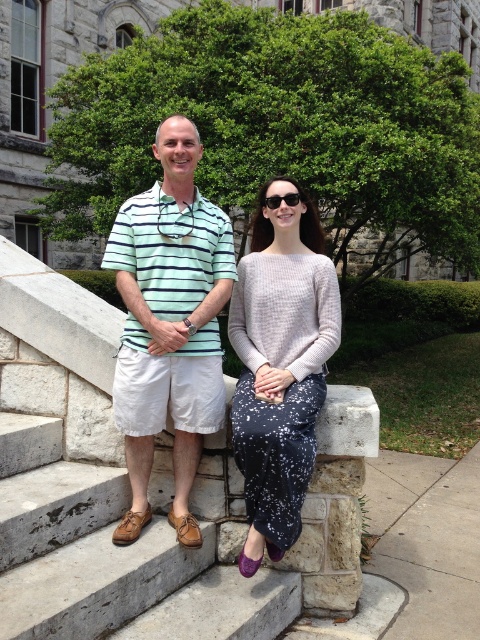
Question: Does brown leather shoe at lower left come in front of black plastic goggles at center?

Choices:
 (A) yes
 (B) no

Answer: (A)

Question: Can you confirm if striped cotton shirt at center is smaller than speckled fabric skirt at center?

Choices:
 (A) no
 (B) yes

Answer: (B)

Question: Considering the real-world distances, which object is closest to the striped cotton shirt at center?

Choices:
 (A) black plastic goggles at center
 (B) brown leather shoe at lower left
 (C) speckled fabric skirt at center

Answer: (C)

Question: Which point appears closest to the camera in this image?

Choices:
 (A) (92, 627)
 (B) (291, 196)

Answer: (A)

Question: Based on their relative distances, which object is farther from the brown leather shoe at lower left?

Choices:
 (A) speckled fabric skirt at center
 (B) black plastic goggles at center
 (C) striped cotton shirt at center

Answer: (B)

Question: Can you confirm if brown leather shoe at lower left is positioned above striped cotton shirt at center?

Choices:
 (A) yes
 (B) no

Answer: (B)